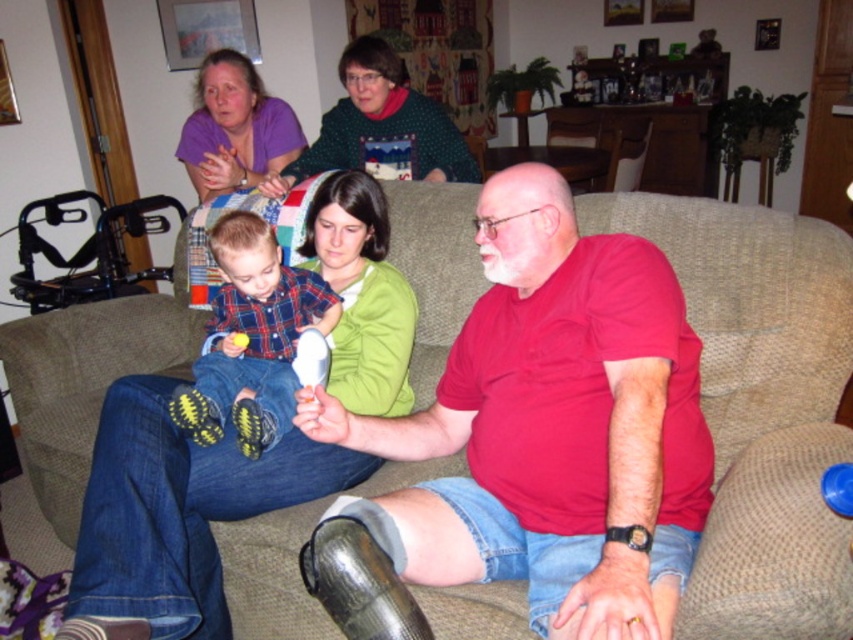
Is red matte shirt at center bigger than green dotted sweater at upper center?

Yes.

Does point (612, 369) lie behind point (328, 168)?

No, (612, 369) is closer to viewer.

What are the coordinates of `red matte shirt at center` in the screenshot? It's located at (552, 428).

Does beige fabric couch at center have a greater height compared to green dotted sweater at upper center?

Correct, beige fabric couch at center is much taller as green dotted sweater at upper center.

Which of these two, beige fabric couch at center or green dotted sweater at upper center, stands taller?

beige fabric couch at center

Is point (671, 196) closer to viewer compared to point (320, 163)?

That is True.

Find the location of a particular element. Image resolution: width=853 pixels, height=640 pixels. beige fabric couch at center is located at coordinates (759, 406).

How far apart are red matte shirt at center and plaid fabric shirt at center?

red matte shirt at center is 20.92 inches from plaid fabric shirt at center.

From the picture: Is the position of red matte shirt at center more distant than that of plaid fabric shirt at center?

No, red matte shirt at center is in front of plaid fabric shirt at center.

Measure the distance between point (x=404, y=420) and camera.

They are 1.64 meters apart.

The width and height of the screenshot is (853, 640). I want to click on red matte shirt at center, so click(x=552, y=428).